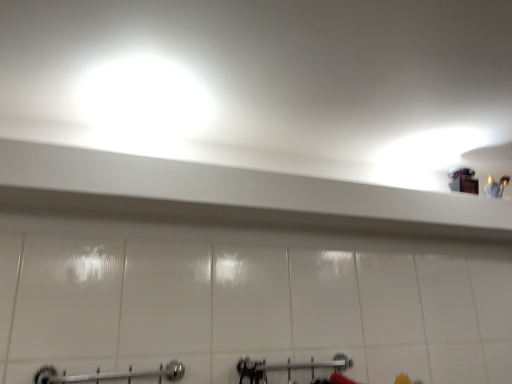
Question: Is chrome metallic towel rack at lower center in front of or behind brushed metal shower at lower center in the image?

Choices:
 (A) behind
 (B) front

Answer: (B)

Question: Considering the positions of point (141, 377) and point (330, 360), is point (141, 377) closer or farther from the camera than point (330, 360)?

Choices:
 (A) closer
 (B) farther

Answer: (A)

Question: From a real-world perspective, is chrome metallic towel rack at lower center positioned above or below brushed metal shower at lower center?

Choices:
 (A) above
 (B) below

Answer: (A)

Question: Choose the correct answer: Is brushed metal shower at lower center inside chrome metallic towel rack at lower center or outside it?

Choices:
 (A) inside
 (B) outside

Answer: (B)

Question: From the image's perspective, relative to chrome metallic towel rack at lower center, is brushed metal shower at lower center above or below?

Choices:
 (A) below
 (B) above

Answer: (A)

Question: Considering the positions of point (272, 364) and point (173, 370), is point (272, 364) closer or farther from the camera than point (173, 370)?

Choices:
 (A) farther
 (B) closer

Answer: (A)

Question: Considering the positions of brushed metal shower at lower center and chrome metallic towel rack at lower center in the image, is brushed metal shower at lower center taller or shorter than chrome metallic towel rack at lower center?

Choices:
 (A) short
 (B) tall

Answer: (B)